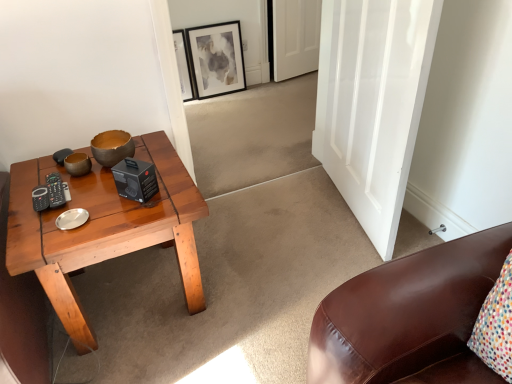
Describe the element at coordinates (373, 103) in the screenshot. The image size is (512, 384). I see `white glossy door at center, the second door when ordered from back to front` at that location.

Locate an element on the screen. The image size is (512, 384). white glossy door at center, acting as the first door starting from the front is located at coordinates (373, 103).

Measure the distance between wooden coffee table at left and camera.

The distance of wooden coffee table at left from camera is 3.96 feet.

Measure the distance between white matte door at upper center, the 1th door in the back-to-front sequence, and camera.

white matte door at upper center, the 1th door in the back-to-front sequence, is 10.64 feet from camera.

This screenshot has height=384, width=512. I want to click on matte black picture frame at upper center, so click(216, 59).

Is white matte door at upper center, the 1th door in the back-to-front sequence, oriented away from matte black picture frame at upper center?

white matte door at upper center, the 1th door in the back-to-front sequence, does not have its back to matte black picture frame at upper center.

Is white matte door at upper center, the 2th door when ordered from bottom to top, wider than matte black picture frame at upper center?

Yes, white matte door at upper center, the 2th door when ordered from bottom to top, is wider than matte black picture frame at upper center.

Choose the correct answer: Is white matte door at upper center, the 1th door in the back-to-front sequence, inside matte black picture frame at upper center or outside it?

white matte door at upper center, the 1th door in the back-to-front sequence, is spatially situated outside matte black picture frame at upper center.

Looking at this image, how different are the orientations of white matte door at upper center, which is counted as the 2th door, starting from the front, and matte black picture frame at upper center in degrees?

The angular difference between white matte door at upper center, which is counted as the 2th door, starting from the front, and matte black picture frame at upper center is 8.46 degrees.

From the image's perspective, is white matte door at upper center, the 1th door in the back-to-front sequence, located above or below wooden coffee table at left?

white matte door at upper center, the 1th door in the back-to-front sequence, is above wooden coffee table at left.

From a real-world perspective, is white matte door at upper center, the 1th door in the back-to-front sequence, below wooden coffee table at left?

No, from a real-world perspective, white matte door at upper center, the 1th door in the back-to-front sequence, is not under wooden coffee table at left.

Which of these two, white matte door at upper center, the 1th door in the back-to-front sequence, or wooden coffee table at left, stands taller?

white matte door at upper center, the 1th door in the back-to-front sequence, is taller.

In the scene shown: Is white glossy door at center, the second door when ordered from back to front, oriented towards white matte door at upper center, which is counted as the 2th door, starting from the front?

No, white glossy door at center, the second door when ordered from back to front, is not oriented towards white matte door at upper center, which is counted as the 2th door, starting from the front.

At what (x,y) coordinates should I click in order to perform the action: click on door lying on the right of white matte door at upper center, the 1th door in the back-to-front sequence. Please return your answer as a coordinate pair (x, y). Image resolution: width=512 pixels, height=384 pixels. Looking at the image, I should click on (373, 103).

Which object is closer to the camera taking this photo, white glossy door at center, the second door when ordered from back to front, or white matte door at upper center, the 1th door in the back-to-front sequence?

white glossy door at center, the second door when ordered from back to front, is in front.

From a real-world perspective, is white glossy door at center, the second door when ordered from back to front, on white matte door at upper center, the 2th door when ordered from bottom to top?

Correct, in the physical world, white glossy door at center, the second door when ordered from back to front, is higher than white matte door at upper center, the 2th door when ordered from bottom to top.

Which of these two, matte brown bowl at center or white matte door at upper center, which is counted as the 2th door, starting from the front, is bigger?

With larger size is white matte door at upper center, which is counted as the 2th door, starting from the front.

Based on the photo, could you tell me if matte brown bowl at center is turned towards white matte door at upper center, the 1th door in the back-to-front sequence?

No, matte brown bowl at center does not turn towards white matte door at upper center, the 1th door in the back-to-front sequence.

How distant is matte brown bowl at center from white matte door at upper center, the 2th door when ordered from bottom to top?

A distance of 6.94 feet exists between matte brown bowl at center and white matte door at upper center, the 2th door when ordered from bottom to top.

Looking at their sizes, would you say matte brown bowl at center is wider or thinner than white matte door at upper center, the 2th door when ordered from bottom to top?

Clearly, matte brown bowl at center has more width compared to white matte door at upper center, the 2th door when ordered from bottom to top.

Can you confirm if matte black picture frame at upper center is taller than matte brown bowl at center?

Correct, matte black picture frame at upper center is much taller as matte brown bowl at center.

Is point (226, 43) positioned behind point (112, 138)?

Yes, point (226, 43) is behind point (112, 138).

Considering the sizes of objects matte black picture frame at upper center and matte brown bowl at center in the image provided, who is smaller, matte black picture frame at upper center or matte brown bowl at center?

matte brown bowl at center.

Is matte brown bowl at center located within matte black picture frame at upper center?

Definitely not — matte brown bowl at center is not inside matte black picture frame at upper center.

From the image's perspective, does matte brown bowl at center appear lower than white glossy door at center, marked as the first door in a bottom-to-top arrangement?

Yes.

Who is shorter, matte brown bowl at center or white glossy door at center, which is the 2th door from top to bottom?

Standing shorter between the two is matte brown bowl at center.

Find the location of a particular element. The height and width of the screenshot is (384, 512). door that is the 2nd object to the right of the matte brown bowl at center, starting at the anchor is located at coordinates (373, 103).

Is matte brown bowl at center positioned beyond the bounds of white glossy door at center, the second door when ordered from back to front?

Absolutely, matte brown bowl at center is external to white glossy door at center, the second door when ordered from back to front.

Considering the relative positions of matte black picture frame at upper center and wooden coffee table at left in the image provided, is matte black picture frame at upper center to the left of wooden coffee table at left from the viewer's perspective?

Incorrect, matte black picture frame at upper center is not on the left side of wooden coffee table at left.

Is matte black picture frame at upper center thinner than wooden coffee table at left?

Indeed, matte black picture frame at upper center has a lesser width compared to wooden coffee table at left.

From the image's perspective, is matte black picture frame at upper center below wooden coffee table at left?

Incorrect, from the image's perspective, matte black picture frame at upper center is higher than wooden coffee table at left.

Which is closer to the camera, (233, 34) or (195, 288)?

Point (233, 34) is positioned farther from the camera compared to point (195, 288).

Where is `picture frame on the left of the white matte door at upper center, the 2th door when ordered from bottom to top`? picture frame on the left of the white matte door at upper center, the 2th door when ordered from bottom to top is located at coordinates (216, 59).

Find the location of a particular element. The height and width of the screenshot is (384, 512). coffee table located underneath the white matte door at upper center, the 1th door in the back-to-front sequence (from a real-world perspective) is located at coordinates (103, 229).

Based on the photo, which object lies nearer to the anchor point matte black picture frame at upper center, white glossy door at center, which is the 2th door from top to bottom, or wooden coffee table at left?

white glossy door at center, which is the 2th door from top to bottom, lies closer to matte black picture frame at upper center than the other object.

Which object lies nearer to the anchor point matte brown bowl at center, matte black picture frame at upper center or wooden coffee table at left?

Based on the image, wooden coffee table at left appears to be nearer to matte brown bowl at center.

Considering their positions, is matte black picture frame at upper center positioned closer to white matte door at upper center, the 1th door in the back-to-front sequence, than matte brown bowl at center?

Based on the image, matte black picture frame at upper center appears to be nearer to white matte door at upper center, the 1th door in the back-to-front sequence.

Which object lies nearer to the anchor point matte brown bowl at center, wooden coffee table at left or white matte door at upper center, which is the 1th door in top-to-bottom order?

Among the two, wooden coffee table at left is located nearer to matte brown bowl at center.

Which object lies further to the anchor point white glossy door at center, the second door when ordered from back to front, white matte door at upper center, which is the 1th door in top-to-bottom order, or matte black picture frame at upper center?

Among the two, white matte door at upper center, which is the 1th door in top-to-bottom order, is located further to white glossy door at center, the second door when ordered from back to front.

Based on the photo, looking at the image, which one is located further to matte black picture frame at upper center, white glossy door at center, the second door when ordered from back to front, or white matte door at upper center, the 1th door in the back-to-front sequence?

The object further to matte black picture frame at upper center is white glossy door at center, the second door when ordered from back to front.

Based on their spatial positions, is matte brown bowl at center or wooden coffee table at left closer to white matte door at upper center, the 2th door when ordered from bottom to top?

Among the two, matte brown bowl at center is located nearer to white matte door at upper center, the 2th door when ordered from bottom to top.

Which object lies further to the anchor point wooden coffee table at left, white matte door at upper center, which is counted as the 2th door, starting from the front, or matte black picture frame at upper center?

Among the two, white matte door at upper center, which is counted as the 2th door, starting from the front, is located further to wooden coffee table at left.

This screenshot has height=384, width=512. In order to click on picture frame located between wooden coffee table at left and white matte door at upper center, the 1th door in the back-to-front sequence, in the depth direction in this screenshot , I will do `click(216, 59)`.

The image size is (512, 384). Find the location of `door between wooden coffee table at left and matte black picture frame at upper center in the front-back direction`. door between wooden coffee table at left and matte black picture frame at upper center in the front-back direction is located at coordinates (373, 103).

Locate an element on the screen. bowl between white glossy door at center, acting as the first door starting from the front, and white matte door at upper center, the 1th door in the back-to-front sequence, along the z-axis is located at coordinates (112, 147).

At what (x,y) coordinates should I click in order to perform the action: click on bowl between wooden coffee table at left and white glossy door at center, which is the 2th door from top to bottom, from left to right. Please return your answer as a coordinate pair (x, y). The width and height of the screenshot is (512, 384). Looking at the image, I should click on (112, 147).